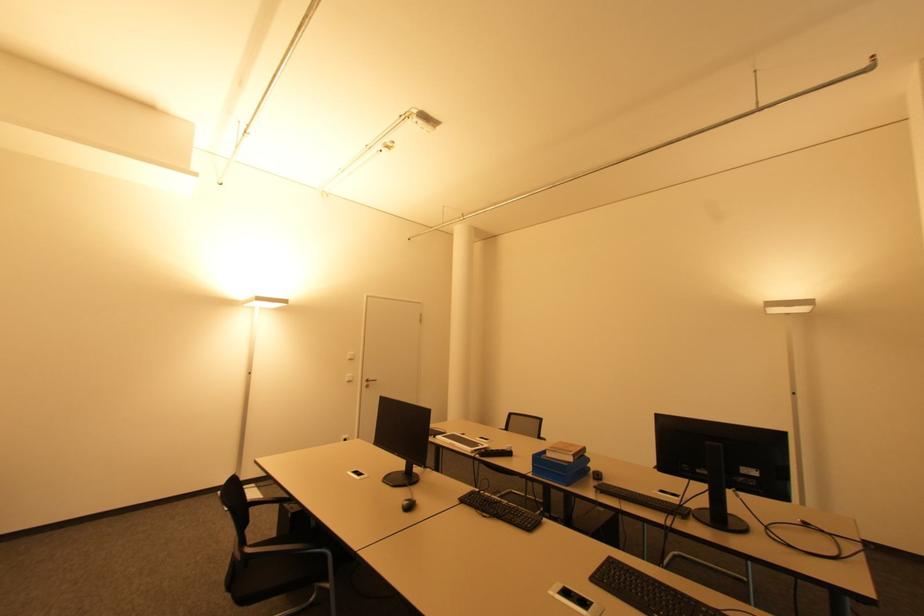
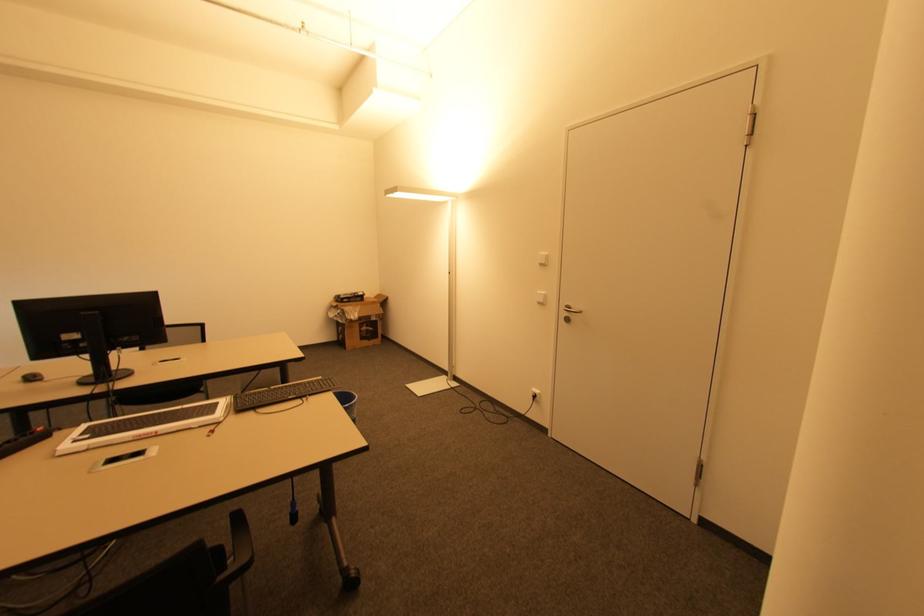
Where in the second image is the point corresponding to (x=347, y=437) from the first image?

(539, 392)